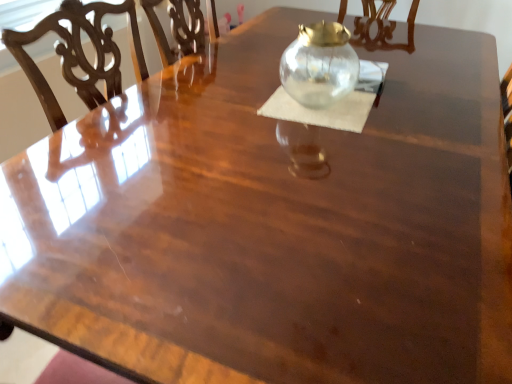
Identify the location of free spot below transparent glass vase at center (from a real-world perspective). The width and height of the screenshot is (512, 384). (306, 96).